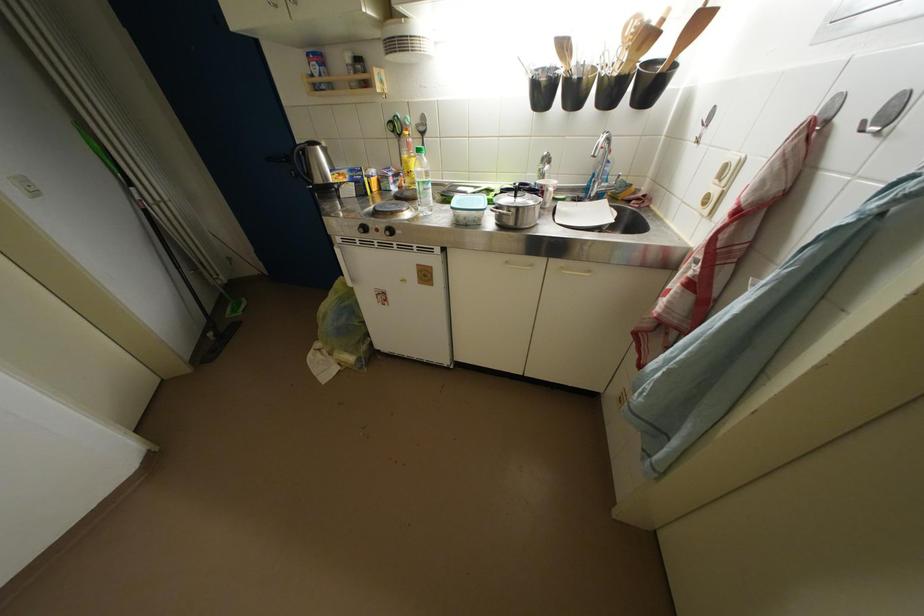
The width and height of the screenshot is (924, 616). I want to click on long handled broom, so click(x=176, y=264).